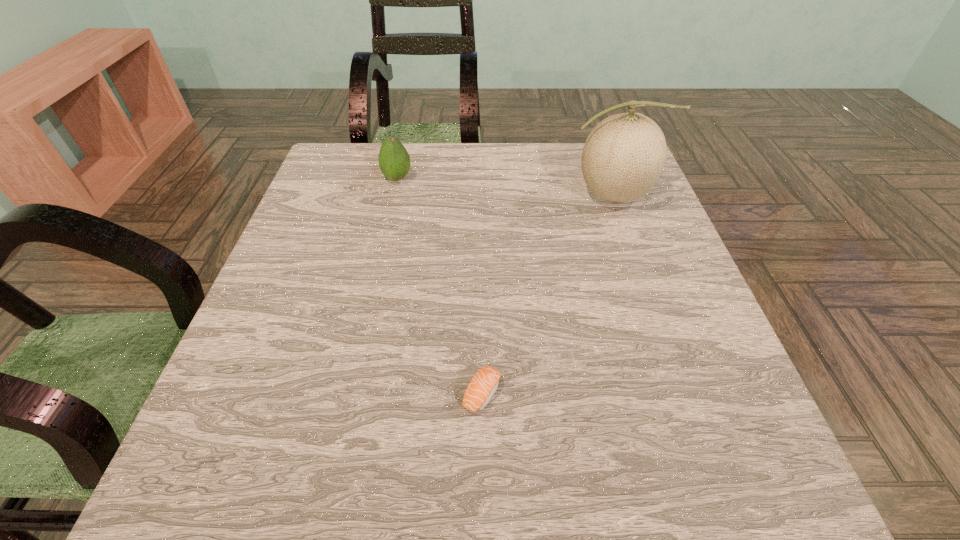
Identify the location of the closest object to the avocado. (624, 155).

The image size is (960, 540). I want to click on free space that satisfies the following two spatial constraints: 1. on the front side of the tallest object; 2. on the right side of the avocado, so click(x=394, y=195).

At what (x,y) coordinates should I click in order to perform the action: click on free location that satisfies the following two spatial constraints: 1. on the back side of the cantaloup; 2. on the right side of the sushi. Please return your answer as a coordinate pair (x, y). This screenshot has width=960, height=540. Looking at the image, I should click on (481, 195).

The width and height of the screenshot is (960, 540). What are the coordinates of `free space in the image that satisfies the following two spatial constraints: 1. on the front side of the leftmost object; 2. on the left side of the nearest object` in the screenshot? It's located at (348, 393).

Locate an element on the screen. The height and width of the screenshot is (540, 960). vacant space that satisfies the following two spatial constraints: 1. on the front side of the avocado; 2. on the left side of the tallest object is located at coordinates (394, 195).

The height and width of the screenshot is (540, 960). In order to click on free location that satisfies the following two spatial constraints: 1. on the front side of the second tallest object; 2. on the left side of the nearest object in this screenshot , I will do `click(348, 393)`.